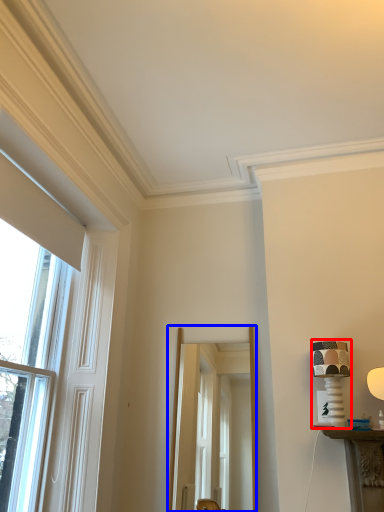
Question: Among these objects, which one is farthest to the camera, table lamp (highlighted by a red box) or screen door (highlighted by a blue box)?

Choices:
 (A) table lamp
 (B) screen door

Answer: (B)